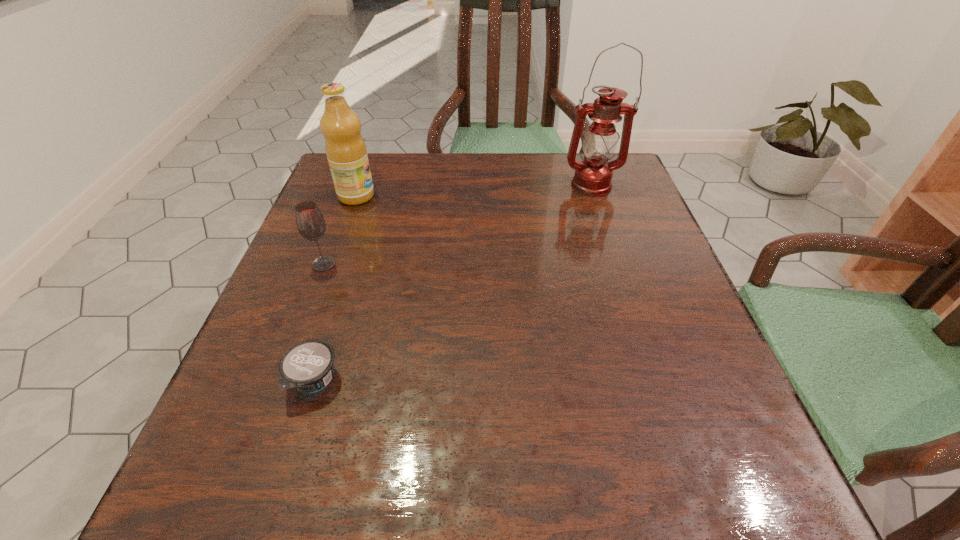
At what (x,y) coordinates should I click in order to perform the action: click on vacant space that's between the rightmost object and the second tallest object. Please return your answer as a coordinate pair (x, y). The height and width of the screenshot is (540, 960). Looking at the image, I should click on (473, 191).

Locate an element on the screen. free space between the third farthest object and the second tallest object is located at coordinates (340, 230).

The height and width of the screenshot is (540, 960). Identify the location of empty location between the rightmost object and the glass drink container. pyautogui.click(x=457, y=225).

Identify the location of free space between the third farthest object and the oil lamp. (457, 225).

Identify the location of free spot between the second nearest object and the third shortest object. Image resolution: width=960 pixels, height=540 pixels. (340, 230).

Select which object appears as the second closest to the yogurt. Please provide its 2D coordinates. Your answer should be formatted as a tuple, i.e. [(x, y)], where the tuple contains the x and y coordinates of a point satisfying the conditions above.

[(345, 148)]

Identify which object is located as the second nearest to the nearest object. Please provide its 2D coordinates. Your answer should be formatted as a tuple, i.e. [(x, y)], where the tuple contains the x and y coordinates of a point satisfying the conditions above.

[(345, 148)]

Where is `free space that satisfies the following two spatial constraints: 1. on the label of the nearest object; 2. on the right side of the olive oil`? free space that satisfies the following two spatial constraints: 1. on the label of the nearest object; 2. on the right side of the olive oil is located at coordinates (290, 381).

In order to click on vacant space that satisfies the following two spatial constraints: 1. on the label of the third shortest object; 2. on the front side of the glass drink container in this screenshot , I will do `click(332, 264)`.

This screenshot has height=540, width=960. What are the coordinates of `free space that satisfies the following two spatial constraints: 1. on the label of the yogurt; 2. on the right side of the olive oil` in the screenshot? It's located at [x=290, y=381].